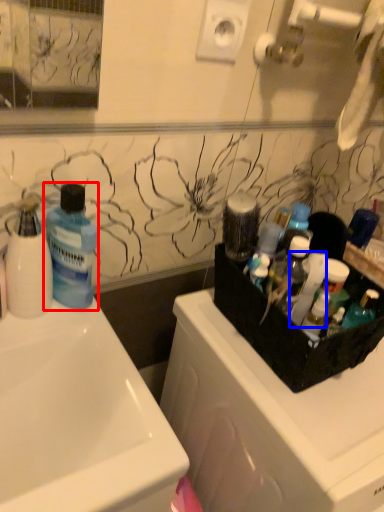
Question: Among these objects, which one is farthest to the camera, bottle (highlighted by a red box) or cleaning product (highlighted by a blue box)?

Choices:
 (A) bottle
 (B) cleaning product

Answer: (B)